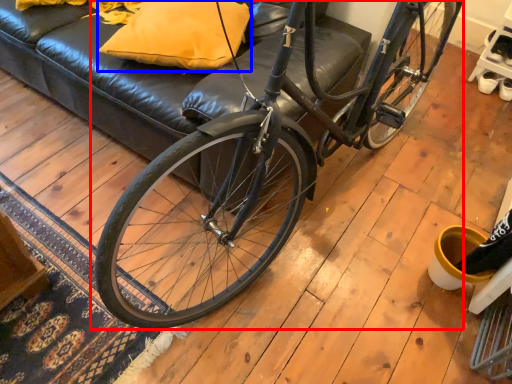
Question: Which object is closer to the camera taking this photo, bicycle (highlighted by a red box) or pillow (highlighted by a blue box)?

Choices:
 (A) bicycle
 (B) pillow

Answer: (A)